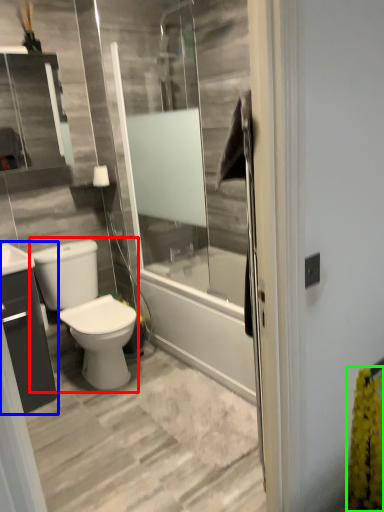
Question: Estimate the real-world distances between objects in this image. Which object is closer to gray (highlighted by a red box), bathroom cabinet (highlighted by a blue box) or flower (highlighted by a green box)?

Choices:
 (A) bathroom cabinet
 (B) flower

Answer: (A)